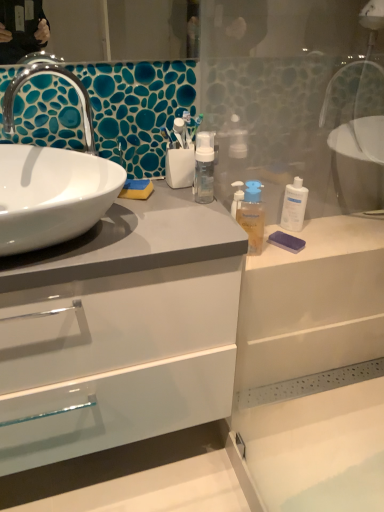
Question: Based on their positions, is white glossy sink at left located to the left or right of purple matte bar of soap at right?

Choices:
 (A) right
 (B) left

Answer: (B)

Question: Does point (8, 206) appear closer or farther from the camera than point (288, 245)?

Choices:
 (A) farther
 (B) closer

Answer: (B)

Question: Estimate the real-world distances between objects in this image. Which object is closer to the translucent plastic mouthwash at center, which appears as the first mouthwash when viewed from the left?

Choices:
 (A) purple matte bar of soap at right
 (B) white glossy cabinet at left
 (C) white glossy sink at left
 (D) white plastic bottle at right, the first mouthwash in the right-to-left sequence

Answer: (A)

Question: Based on their relative distances, which object is nearer to the translucent plastic mouthwash at center, acting as the second mouthwash starting from the right?

Choices:
 (A) white glossy sink at left
 (B) white plastic bottle at right, marked as the second mouthwash in a front-to-back arrangement
 (C) white glossy cabinet at left
 (D) purple matte bar of soap at right

Answer: (D)